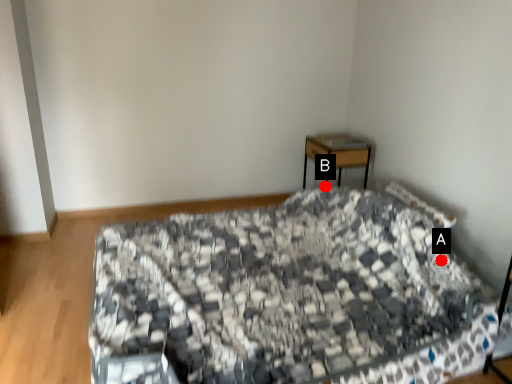
Question: Two points are circled on the image, labeled by A and B beside each circle. Which point is farther to the camera?

Choices:
 (A) A is further
 (B) B is further

Answer: (B)